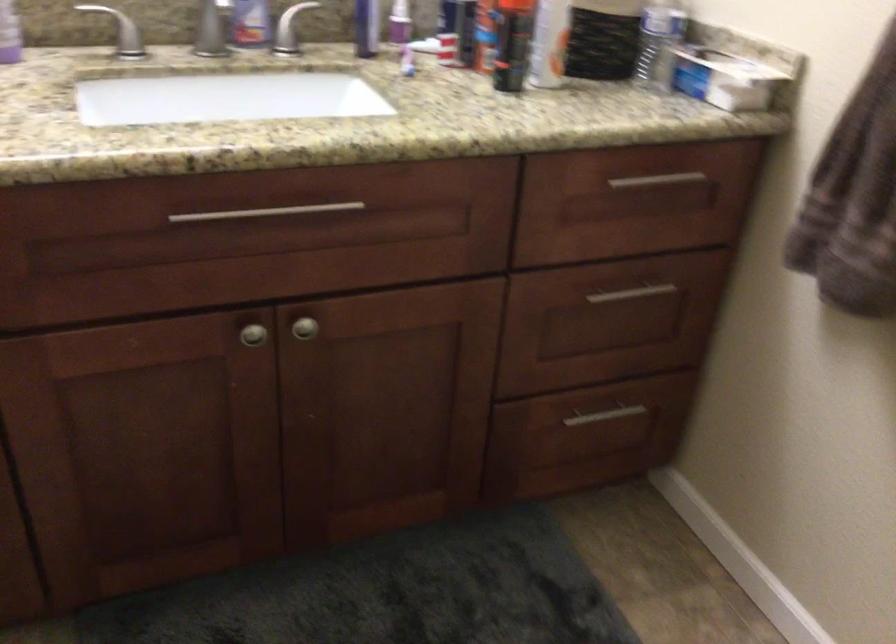
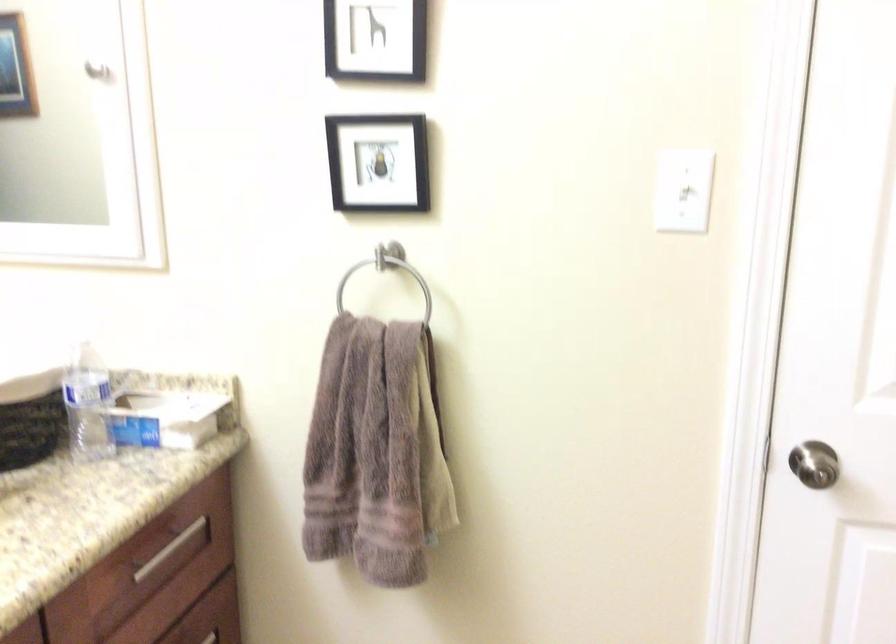
Where in the second image is the point corresponding to [648,183] from the first image?

(168, 549)